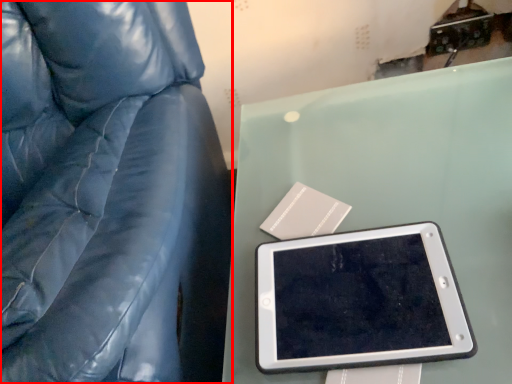
Question: In this image, where is furniture (annotated by the red box) located relative to tablet computer?

Choices:
 (A) left
 (B) right

Answer: (A)